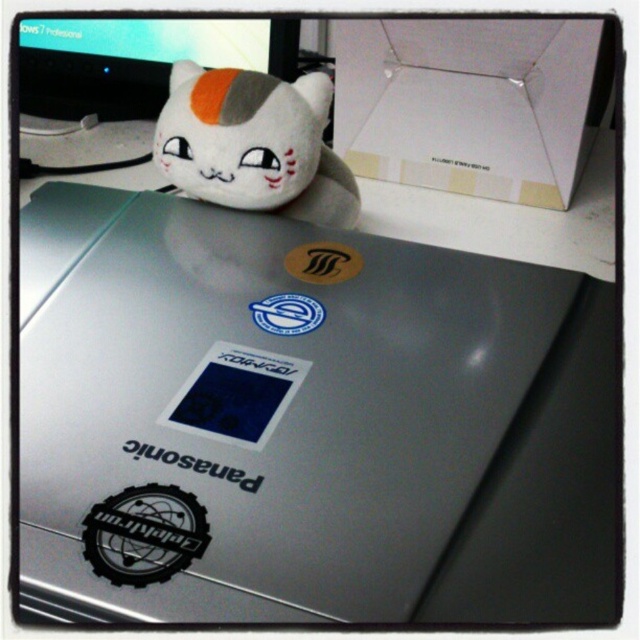
Question: Which point is closer to the camera?

Choices:
 (A) (209, 460)
 (B) (269, 385)
 (C) (268, 93)

Answer: (A)

Question: Based on their relative distances, which object is farther from the silver metallic laptop at center?

Choices:
 (A) matte black monitor at upper left
 (B) blue matte sticker at center

Answer: (A)

Question: Is white plush cat at upper center smaller than blue matte sticker at center?

Choices:
 (A) no
 (B) yes

Answer: (A)

Question: Does silver metallic laptop at center lie behind white plush cat at upper center?

Choices:
 (A) yes
 (B) no

Answer: (B)

Question: Does white plush cat at upper center come behind blue matte sticker at center?

Choices:
 (A) yes
 (B) no

Answer: (A)

Question: Which object is farther from the camera taking this photo?

Choices:
 (A) matte black monitor at upper left
 (B) white plush cat at upper center
 (C) blue glossy sticker at center

Answer: (A)